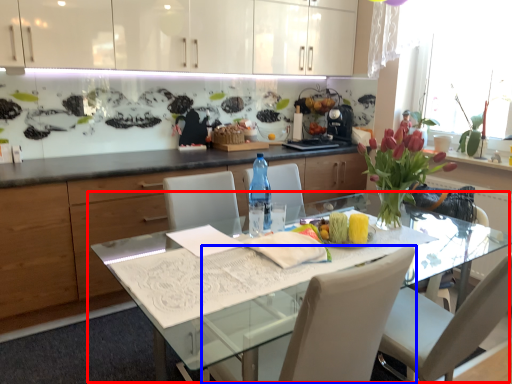
Question: Which point is further to the camera, kitchen & dining room table (highlighted by a red box) or chair (highlighted by a blue box)?

Choices:
 (A) kitchen & dining room table
 (B) chair

Answer: (A)